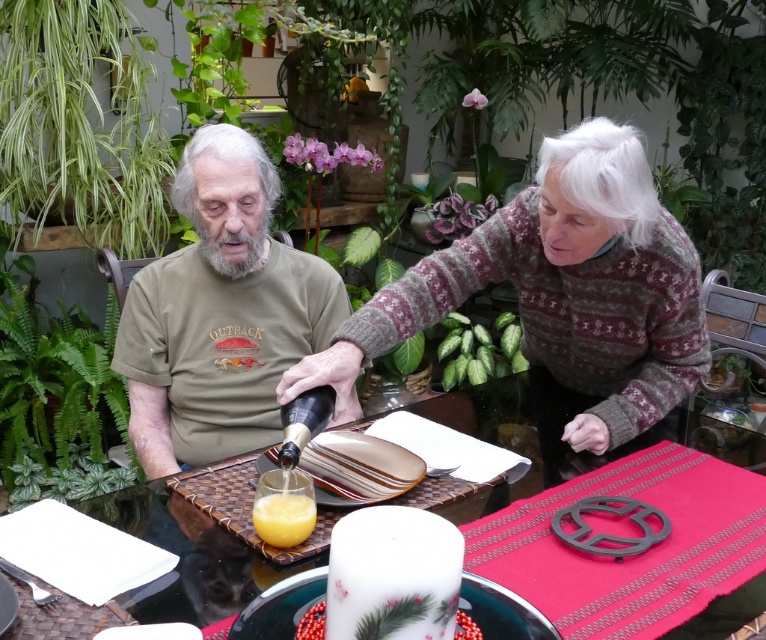
Is translucent glass table at center above white glossy candle at center?

Yes, translucent glass table at center is above white glossy candle at center.

Does translucent glass table at center come in front of white glossy candle at center?

Yes, translucent glass table at center is closer to the viewer.

Between point (123, 508) and point (308, 637), which one is positioned behind?

The point (123, 508) is behind.

This screenshot has height=640, width=766. Identify the location of translucent glass table at center. (188, 556).

Is knitted sweater at upper right shorter than translucent glass cup at center?

No.

Is knitted sweater at upper right to the right of translucent glass cup at center from the viewer's perspective?

Indeed, knitted sweater at upper right is positioned on the right side of translucent glass cup at center.

From the picture: Who is more distant from viewer, (x=642, y=381) or (x=296, y=518)?

Point (x=642, y=381)

This screenshot has width=766, height=640. Identify the location of knitted sweater at upper right. (558, 291).

Is green matte shirt at center above white glossy candle at center?

Yes, green matte shirt at center is above white glossy candle at center.

What do you see at coordinates (221, 314) in the screenshot? I see `green matte shirt at center` at bounding box center [221, 314].

In order to click on green matte shirt at center in this screenshot , I will do `click(221, 314)`.